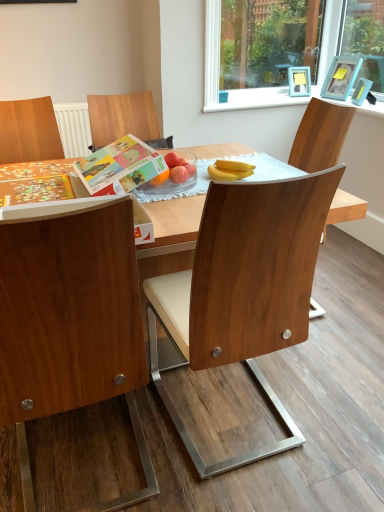
Question: From the image's perspective, is matte paper book at center located beneath wooden chair at center, the 1th chair positioned from the right?

Choices:
 (A) yes
 (B) no

Answer: (B)

Question: Does matte paper book at center have a lesser width compared to wooden chair at center, the 2th chair when ordered from left to right?

Choices:
 (A) yes
 (B) no

Answer: (A)

Question: Is matte paper book at center shorter than wooden chair at center, the 1th chair positioned from the right?

Choices:
 (A) yes
 (B) no

Answer: (A)

Question: Does matte paper book at center come in front of wooden chair at center, the 1th chair positioned from the right?

Choices:
 (A) yes
 (B) no

Answer: (B)

Question: Considering the relative positions of matte paper book at center and wooden chair at center, the 2th chair when ordered from left to right, in the image provided, is matte paper book at center to the left of wooden chair at center, the 2th chair when ordered from left to right, from the viewer's perspective?

Choices:
 (A) yes
 (B) no

Answer: (A)

Question: Is matte paper book at center aimed at wooden chair at center, the 1th chair positioned from the right?

Choices:
 (A) no
 (B) yes

Answer: (A)

Question: Considering the relative sizes of blue plastic picture frame at upper right, arranged as the first picture frame when ordered from the bottom, and wooden chair at left, placed as the 2th chair when sorted from right to left, in the image provided, is blue plastic picture frame at upper right, arranged as the first picture frame when ordered from the bottom, wider than wooden chair at left, placed as the 2th chair when sorted from right to left,?

Choices:
 (A) no
 (B) yes

Answer: (A)

Question: From a real-world perspective, does blue plastic picture frame at upper right, the second picture frame positioned from the top, stand above wooden chair at left, placed as the 2th chair when sorted from right to left?

Choices:
 (A) yes
 (B) no

Answer: (A)

Question: Does blue plastic picture frame at upper right, the second picture frame positioned from the top, appear on the left side of wooden chair at left, marked as the first chair in a left-to-right arrangement?

Choices:
 (A) yes
 (B) no

Answer: (B)

Question: Is blue plastic picture frame at upper right, the second picture frame positioned from the top, facing away from wooden chair at left, placed as the 2th chair when sorted from right to left?

Choices:
 (A) yes
 (B) no

Answer: (B)

Question: Is the position of blue plastic picture frame at upper right, arranged as the first picture frame when ordered from the bottom, more distant than that of wooden chair at left, marked as the first chair in a left-to-right arrangement?

Choices:
 (A) yes
 (B) no

Answer: (A)

Question: Is blue plastic picture frame at upper right, the second picture frame positioned from the top, outside of wooden chair at left, placed as the 2th chair when sorted from right to left?

Choices:
 (A) yes
 (B) no

Answer: (A)

Question: From a real-world perspective, is white plastic window frame at upper right physically below yellow matte bananas at center?

Choices:
 (A) yes
 (B) no

Answer: (B)